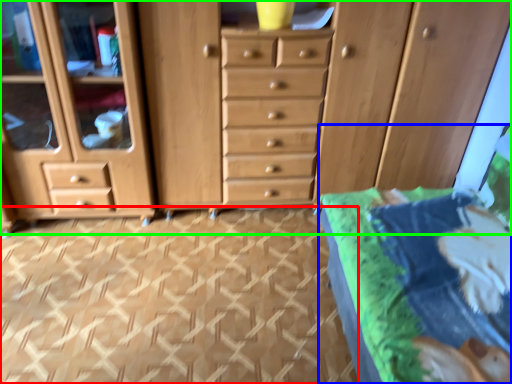
Question: Estimate the real-world distances between objects in this image. Which object is closer to tile (highlighted by a red box), bed (highlighted by a blue box) or chest of drawers (highlighted by a green box)?

Choices:
 (A) bed
 (B) chest of drawers

Answer: (B)